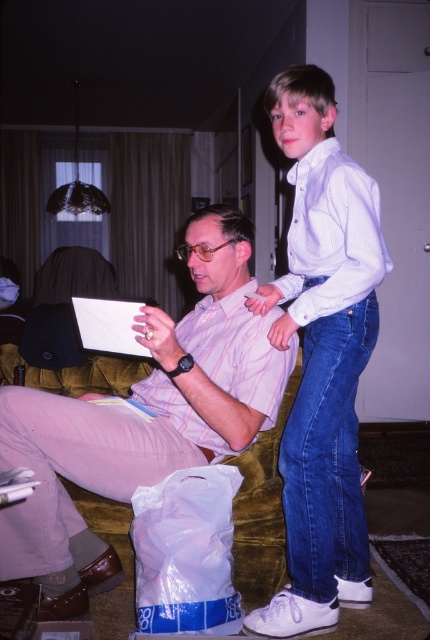
Which is more to the left, pink fabric shirt at center or pink striped shirt at center?

From the viewer's perspective, pink fabric shirt at center appears more on the left side.

Does pink fabric shirt at center have a larger size compared to pink striped shirt at center?

Yes, pink fabric shirt at center is bigger than pink striped shirt at center.

Who is more forward, (x=163, y=461) or (x=218, y=458)?

Point (x=163, y=461) is more forward.

I want to click on pink fabric shirt at center, so click(x=143, y=417).

Who is lower down, pink fabric shirt at center or white denim jeans at upper right?

pink fabric shirt at center is lower down.

Is pink fabric shirt at center thinner than white denim jeans at upper right?

No, pink fabric shirt at center is not thinner than white denim jeans at upper right.

Describe the element at coordinates (143, 417) in the screenshot. The width and height of the screenshot is (430, 640). I see `pink fabric shirt at center` at that location.

Find the location of a particular element. Image resolution: width=430 pixels, height=640 pixels. pink fabric shirt at center is located at coordinates (143, 417).

Does point (303, 580) lie behind point (224, 378)?

That is False.

This screenshot has height=640, width=430. Describe the element at coordinates (322, 356) in the screenshot. I see `white denim jeans at upper right` at that location.

Where is `white denim jeans at upper right`? This screenshot has height=640, width=430. white denim jeans at upper right is located at coordinates (322, 356).